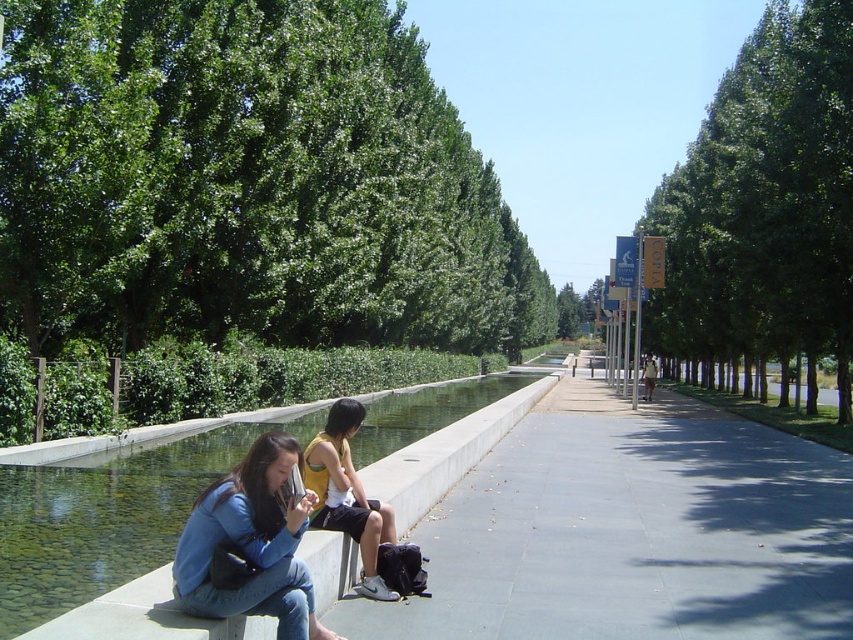
You are standing in the park and want to take a photo of both point (x=315, y=68) and point (x=206, y=582) in the same frame. Which point is closer to the camera so that you can ensure both are in focus?

Point (x=206, y=582) is closer to the camera than point (x=315, y=68), so to ensure both are in focus, you should focus on the point that is closer, which is point (x=206, y=582).

You are a photographer trying to capture a wide shot of the green leafy trees at center and the blue denim jeans at lower left. Since you want both subjects in the frame, which object should you focus on to ensure both are visible?

The green leafy trees at center are wider than the blue denim jeans at lower left, so focusing on the trees will help ensure both are visible in the frame.

You are standing at the edge of the canal and want to hand a small item to the person wearing the blue denim jeans at lower left. Since you can only reach as far as the yellow jersey at center, can you successfully reach them?

The blue denim jeans at lower left is below the yellow jersey at center, so the person wearing the blue denim jeans at lower left is closer to you. Since you can reach as far as the yellow jersey at center, you can successfully reach them.